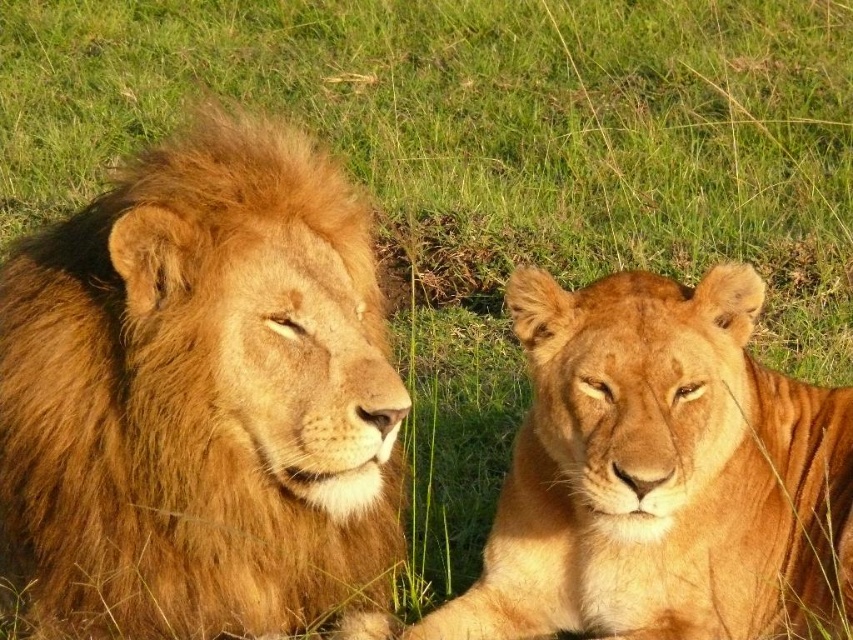
Question: Is golden fur lion at left positioned before golden fur lion at right?

Choices:
 (A) yes
 (B) no

Answer: (A)

Question: Does golden fur lion at left lie in front of golden fur lion at right?

Choices:
 (A) no
 (B) yes

Answer: (B)

Question: Which object is farther from the camera taking this photo?

Choices:
 (A) golden fur lion at right
 (B) golden fur lion at left

Answer: (A)

Question: Can you confirm if golden fur lion at left is thinner than golden fur lion at right?

Choices:
 (A) no
 (B) yes

Answer: (B)